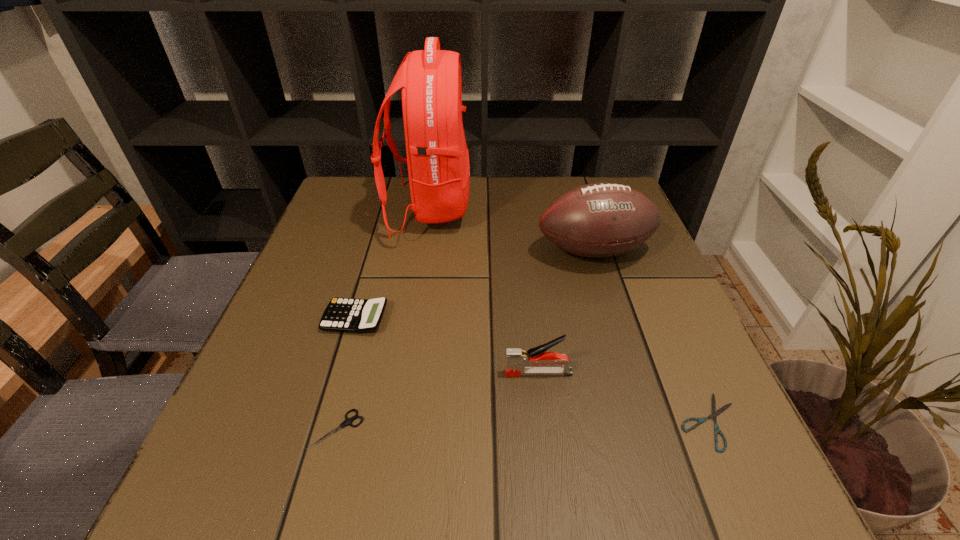
In order to click on empty space between the tallest object and the third farthest object in this screenshot , I will do `click(393, 264)`.

You are a GUI agent. You are given a task and a screenshot of the screen. Output one action in this format:
    pyautogui.click(x=<x>, y=<y>)
    Task: Click on the vacant space that is in between the left shears and the fifth shortest object
    This screenshot has height=540, width=960.
    Given the screenshot: What is the action you would take?
    466,340

What are the coordinates of `blank region between the tallest object and the second shortest object` in the screenshot? It's located at (x=383, y=319).

At what (x,y) coordinates should I click in order to perform the action: click on vacant area between the fifth tallest object and the tallest object. Please return your answer as a coordinate pair (x, y). This screenshot has width=960, height=540. Looking at the image, I should click on (383, 319).

Where is `free space between the fourth farthest object and the taller shears`? The image size is (960, 540). free space between the fourth farthest object and the taller shears is located at coordinates (438, 401).

I want to click on free space that is in between the stapler and the backpack, so click(x=484, y=291).

This screenshot has width=960, height=540. Identify the location of blank region between the fourth nearest object and the backpack. (393, 264).

Locate which object ranks in proximity to the fourth shortest object. Please provide its 2D coordinates. Your answer should be formatted as a tuple, i.e. [(x, y)], where the tuple contains the x and y coordinates of a point satisfying the conditions above.

[(715, 413)]

Identify which object is the second nearest to the fifth shortest object. Please provide its 2D coordinates. Your answer should be formatted as a tuple, i.e. [(x, y)], where the tuple contains the x and y coordinates of a point satisfying the conditions above.

[(516, 359)]

Where is `free point that satisfies the following two spatial constraints: 1. on the handle side of the right shears; 2. on the right side of the stapler`? free point that satisfies the following two spatial constraints: 1. on the handle side of the right shears; 2. on the right side of the stapler is located at coordinates (544, 421).